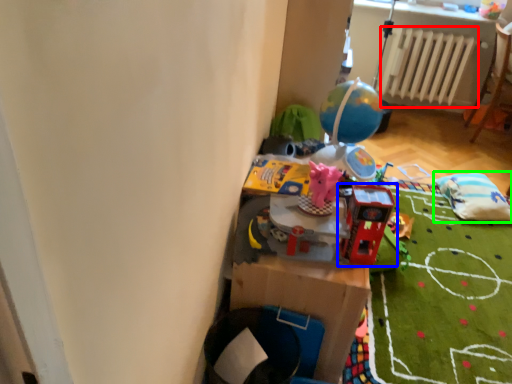
Question: Which is nearer to the radiator (highlighted by a red box)? toy (highlighted by a blue box) or bean bag chair (highlighted by a green box).

Choices:
 (A) toy
 (B) bean bag chair

Answer: (B)